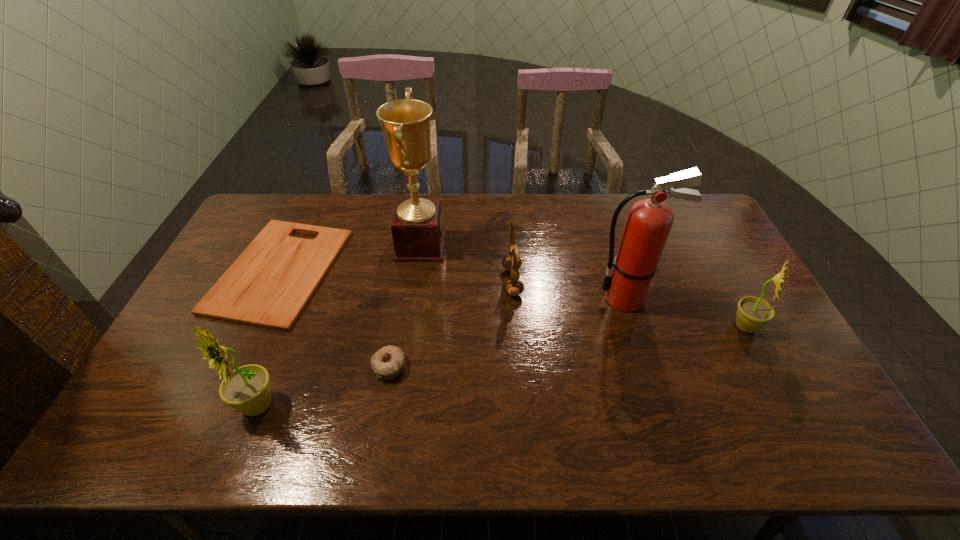
At what (x,y) coordinates should I click in order to perform the action: click on blank region between the trophy cup and the shortest object. Please return your answer as a coordinate pair (x, y). This screenshot has height=540, width=960. Looking at the image, I should click on (350, 258).

I want to click on empty space that is in between the second shortest object and the left sunflower, so click(x=324, y=386).

The width and height of the screenshot is (960, 540). I want to click on unoccupied position between the doughnut and the fifth object from left to right, so click(x=450, y=324).

Locate an element on the screen. The height and width of the screenshot is (540, 960). vacant region between the third tallest object and the trophy cup is located at coordinates (339, 326).

The height and width of the screenshot is (540, 960). I want to click on free space between the fifth object from left to right and the sixth object from left to right, so click(x=569, y=291).

Locate an element on the screen. This screenshot has width=960, height=540. unoccupied area between the earphone and the trophy cup is located at coordinates (467, 264).

Where is `free spot between the trophy cup and the second shortest object`? free spot between the trophy cup and the second shortest object is located at coordinates (405, 306).

Find the location of a particular element. The height and width of the screenshot is (540, 960). vacant space that is in between the chopping board and the fifth object from left to right is located at coordinates (396, 276).

The width and height of the screenshot is (960, 540). Identify the location of empty location between the nearest object and the second object from right to left. (442, 352).

Locate an element on the screen. Image resolution: width=960 pixels, height=540 pixels. vacant space that's between the fire extinguisher and the earphone is located at coordinates (569, 291).